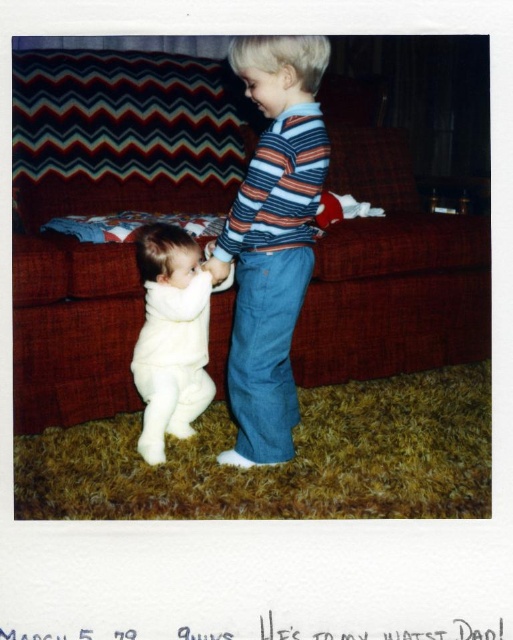
Question: Is striped cotton shirt at center bigger than white fuzzy onesie at lower left?

Choices:
 (A) yes
 (B) no

Answer: (A)

Question: Is striped cotton shirt at center behind white fuzzy onesie at lower left?

Choices:
 (A) yes
 (B) no

Answer: (B)

Question: Among these points, which one is farthest from the camera?

Choices:
 (A) (163, 259)
 (B) (285, 154)

Answer: (A)

Question: Which of the following is the farthest from the observer?

Choices:
 (A) striped cotton shirt at center
 (B) white fuzzy onesie at lower left

Answer: (B)

Question: Does striped cotton shirt at center have a greater width compared to white fuzzy onesie at lower left?

Choices:
 (A) yes
 (B) no

Answer: (A)